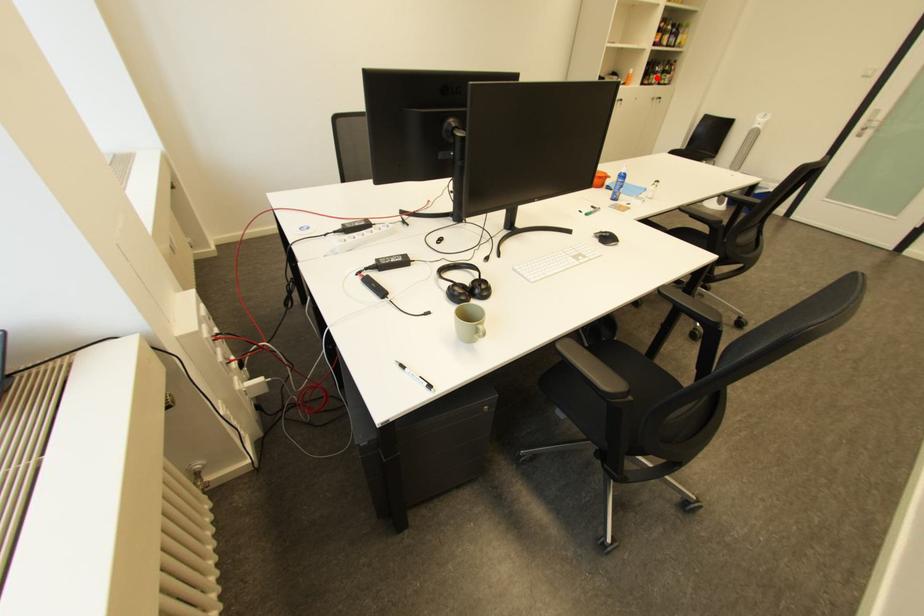
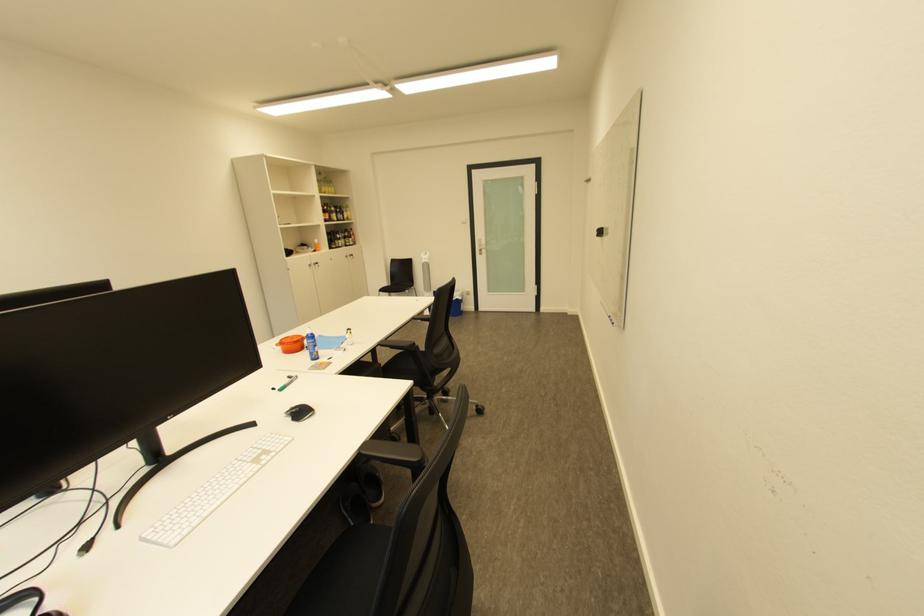
Question: I am providing you with two images of the same scene from different viewpoints. Image1 has a red point marked. In image2, the corresponding 3D location appears at what relative position? Reply with the corresponding letter.

Choices:
 (A) Closer
 (B) Farther

Answer: (A)